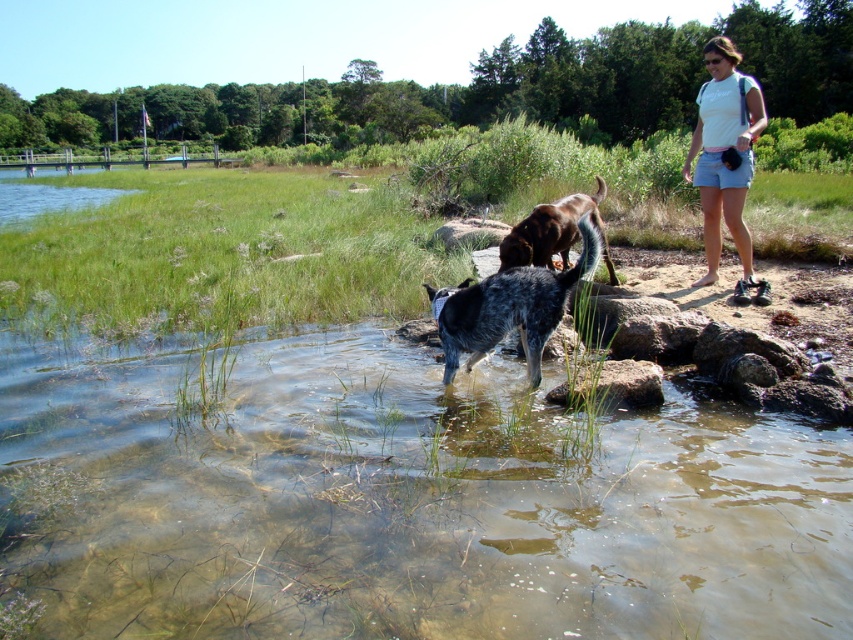
You are a photographer trying to capture both the brown fur dog at center and the smooth gray rock at lower center in the same frame. Given their sizes, which one might you need to adjust your camera angle to include fully in the photo?

The brown fur dog at center is larger in size than the smooth gray rock at lower center, so you might need to adjust your camera angle to include the brown fur dog at center fully in the photo.

You are planning to take a photo of the white cotton shirt at upper right while standing at the point marked by the coordinates point (724, 152). Is the white cotton shirt at upper right visible from this position?

The point (724, 152) is where the white cotton shirt at upper right is located, so yes, you are at the same position as the white cotton shirt at upper right and can see it directly.